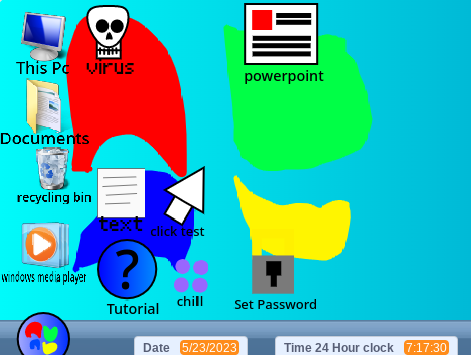
The image size is (471, 355). Identify the location of monitor. (43, 48), (42, 37), (33, 28), (44, 25), (52, 44).